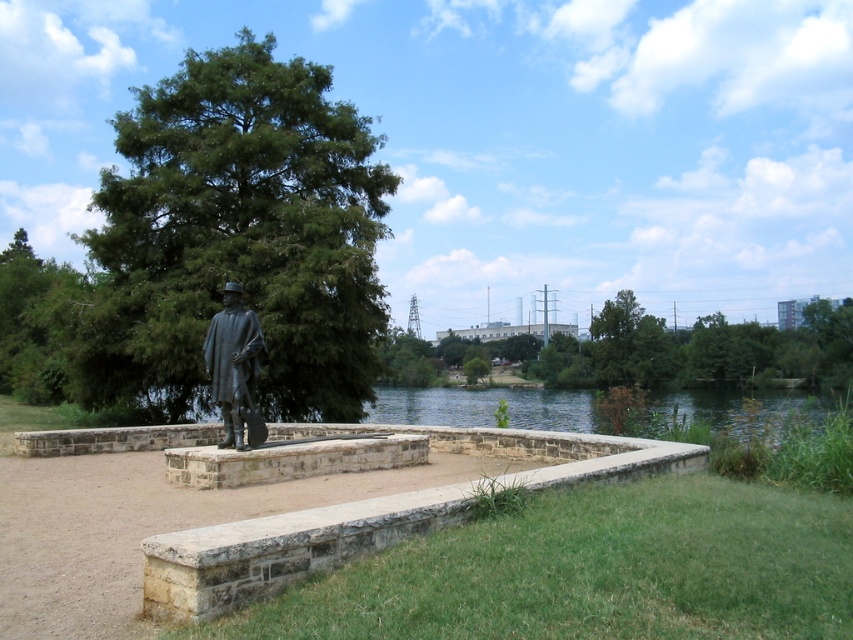
Looking at this image, you are standing on the grassy area in front of the statue. You want to place a small potted plant between the green matte tree at center and the stone ledge at center. Which object should the plant be closer to, the tree or the ledge?

The green matte tree at center is above the stone ledge at center, so the plant should be placed closer to the stone ledge at center to be between them.

You are standing in the outdoor scene and want to walk from the statue to the grassy area. Which direction should you go relative to the green matte tree at center and the stone ledge at center?

To reach the grassy area from the statue, you should move to the right of the green matte tree at center and the stone ledge at center since the grassy area is in the foreground and the tree is to the left of the ledge.